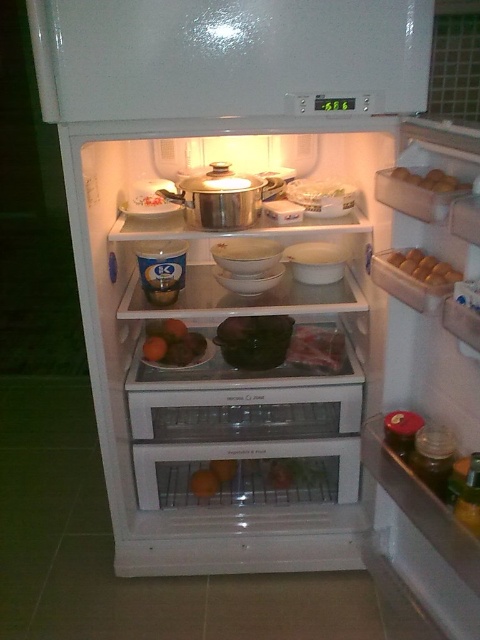
Question: Does orange matte at center have a larger size compared to brown egg carton at upper right?

Choices:
 (A) no
 (B) yes

Answer: (B)

Question: Estimate the real-world distances between objects in this image. Which object is farther from the brown egg carton at upper right?

Choices:
 (A) green matte vegetable at center
 (B) orange matte at center

Answer: (B)

Question: Which point is farther from the camera taking this photo?

Choices:
 (A) (441, 269)
 (B) (184, 333)

Answer: (B)

Question: Which object is the closest to the brown matte eggs at upper right?

Choices:
 (A) green matte vegetable at center
 (B) orange matte at center
 (C) brown egg carton at upper right

Answer: (C)

Question: Can you confirm if brown matte eggs at upper right is thinner than brown egg carton at upper right?

Choices:
 (A) no
 (B) yes

Answer: (B)

Question: Does green matte vegetable at center have a smaller size compared to brown matte eggs at upper right?

Choices:
 (A) yes
 (B) no

Answer: (B)